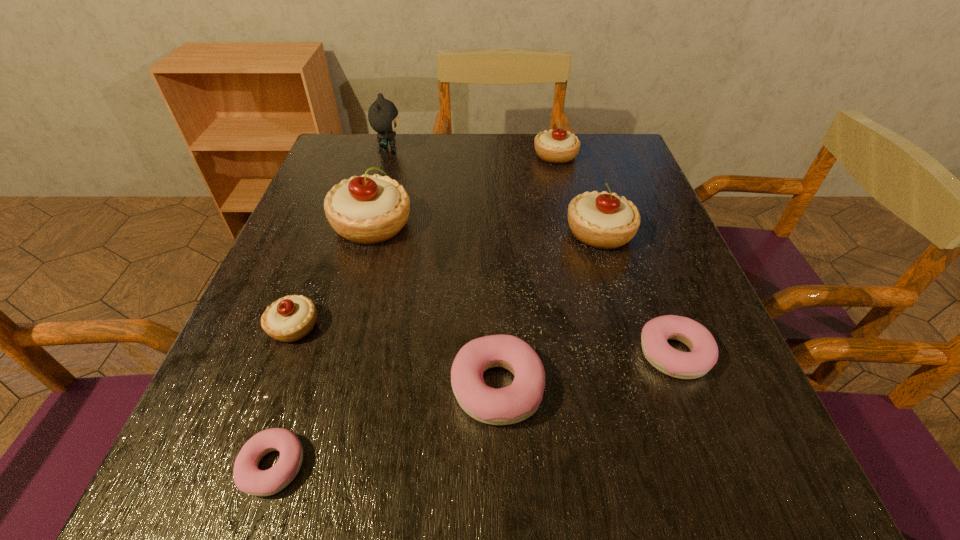
I want to click on the second shortest pastry, so (x=704, y=351).

This screenshot has width=960, height=540. I want to click on the rightmost pink pastry, so click(704, 351).

In order to click on the shortest pastry in this screenshot , I will do `click(249, 479)`.

Identify the location of the shortest object. (249, 479).

This screenshot has height=540, width=960. I want to click on vacant space located on the front-facing side of the gray kitten, so click(x=446, y=149).

The height and width of the screenshot is (540, 960). Find the location of `vacant point located 0.240m on the front of the tallest pastry`. vacant point located 0.240m on the front of the tallest pastry is located at coordinates (339, 346).

The width and height of the screenshot is (960, 540). I want to click on vacant area located 0.050m on the left of the sixth shortest pastry, so click(542, 233).

Locate an element on the screen. This screenshot has width=960, height=540. free region located 0.080m on the front of the farthest beige pastry is located at coordinates (563, 185).

Locate an element on the screen. blank space located on the back of the smallest beige pastry is located at coordinates (317, 266).

This screenshot has width=960, height=540. Identify the location of free space located 0.080m on the left of the fourth object from right to left. (400, 387).